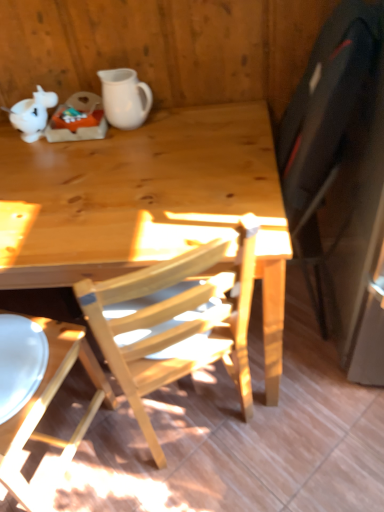
What do you see at coordinates (125, 98) in the screenshot? The image size is (384, 512). I see `white matte pitcher at upper left` at bounding box center [125, 98].

The image size is (384, 512). What are the coordinates of `natural wood desk at center` in the screenshot? It's located at (147, 204).

I want to click on white matte pitcher at upper left, so click(x=125, y=98).

Does point (53, 320) come farther from viewer compared to point (262, 284)?

That is True.

Find the location of a particular element. This screenshot has height=512, width=384. desk above the wooden chair at lower left (from the image's perspective) is located at coordinates point(147,204).

From the image's perspective, which is below, wooden chair at lower left or natural wood desk at center?

wooden chair at lower left, from the image's perspective.

How distant is wooden chair at lower left from natural wood desk at center?

They are 17.82 inches apart.

Is the position of natural wood desk at center less distant than that of white matte teapot at upper left?

Yes.

Between natural wood desk at center and white matte teapot at upper left, which one has less height?

Standing shorter between the two is white matte teapot at upper left.

Looking at the image, does natural wood desk at center seem bigger or smaller compared to white matte teapot at upper left?

In the image, natural wood desk at center appears to be larger than white matte teapot at upper left.

From the image's perspective, who appears lower, white matte pitcher at upper left or white matte teapot at upper left?

white matte teapot at upper left appears lower in the image.

The width and height of the screenshot is (384, 512). In order to click on teapot below the white matte pitcher at upper left (from the image's perspective) in this screenshot , I will do `click(32, 114)`.

In the scene shown: Is white matte pitcher at upper left oriented away from white matte teapot at upper left?

white matte pitcher at upper left does not have its back to white matte teapot at upper left.

From a real-world perspective, does white matte pitcher at upper left sit lower than white matte teapot at upper left?

Actually, white matte pitcher at upper left is physically above white matte teapot at upper left in the real world.

In terms of size, does natural wood desk at center appear bigger or smaller than white matte pitcher at upper left?

Clearly, natural wood desk at center is larger in size than white matte pitcher at upper left.

Is white matte pitcher at upper left a part of natural wood desk at center?

No, white matte pitcher at upper left is not surrounded by natural wood desk at center.

What's the angular difference between natural wood desk at center and white matte pitcher at upper left's facing directions?

They differ by 1.21 degrees in their facing directions.

Find the location of `coffee cup above the natural wood desk at center (from the image's perspective)`. coffee cup above the natural wood desk at center (from the image's perspective) is located at coordinates (125, 98).

From a real-world perspective, is white matte pitcher at upper left over wooden chair at lower left?

Yes, from a real-world perspective, white matte pitcher at upper left is over wooden chair at lower left

From the image's perspective, is white matte pitcher at upper left above or below wooden chair at lower left?

Based on their image positions, white matte pitcher at upper left is located above wooden chair at lower left.

Does point (116, 108) come in front of point (46, 339)?

No, it is behind (46, 339).

Does white matte pitcher at upper left have a greater height compared to wooden chair at lower left?

In fact, white matte pitcher at upper left may be shorter than wooden chair at lower left.

Is white matte teapot at upper left thinner than natural wood desk at center?

Yes.

Is white matte teapot at upper left positioned beyond the bounds of natural wood desk at center?

Yes, white matte teapot at upper left is not within natural wood desk at center.

Is white matte teapot at upper left facing towards natural wood desk at center?

No, white matte teapot at upper left is not turned towards natural wood desk at center.

Can you tell me how much white matte teapot at upper left and natural wood desk at center differ in facing direction?

1.21 degrees.

Which is more to the right, wooden chair at lower left or white matte teapot at upper left?

white matte teapot at upper left.

Considering the relative sizes of wooden chair at lower left and white matte teapot at upper left in the image provided, is wooden chair at lower left bigger than white matte teapot at upper left?

Yes, wooden chair at lower left is bigger than white matte teapot at upper left.

Looking at this image, from the image's perspective, which one is positioned higher, wooden chair at lower left or white matte teapot at upper left?

white matte teapot at upper left, from the image's perspective.

Is wooden chair at lower left taller than white matte teapot at upper left?

Yes.

Locate an element on the screen. desk lying above the wooden chair at lower left (from the image's perspective) is located at coordinates (147, 204).

You are a GUI agent. You are given a task and a screenshot of the screen. Output one action in this format:
    pyautogui.click(x=<x>, y=<y>)
    Task: Click on the desk that is under the white matte teapot at upper left (from a real-world perspective)
    This screenshot has width=384, height=512.
    Given the screenshot: What is the action you would take?
    pyautogui.click(x=147, y=204)

Which object lies nearer to the anchor point natural wood desk at center, white matte pitcher at upper left or white matte teapot at upper left?

white matte pitcher at upper left is closer to natural wood desk at center.

From the image, which object appears to be farther from natural wood desk at center, wooden chair at lower left or white matte teapot at upper left?

white matte teapot at upper left is further to natural wood desk at center.

Looking at the image, which one is located closer to white matte pitcher at upper left, white matte teapot at upper left or natural wood desk at center?

white matte teapot at upper left.

Estimate the real-world distances between objects in this image. Which object is closer to white matte pitcher at upper left, wooden chair at lower left or white matte teapot at upper left?

The object closer to white matte pitcher at upper left is white matte teapot at upper left.

From the image, which object appears to be nearer to white matte teapot at upper left, wooden chair at lower left or white matte pitcher at upper left?

The object closer to white matte teapot at upper left is white matte pitcher at upper left.

From the image, which object appears to be nearer to white matte teapot at upper left, white matte pitcher at upper left or wooden chair at lower left?

white matte pitcher at upper left.

Estimate the real-world distances between objects in this image. Which object is closer to white matte teapot at upper left, wooden chair at lower left or natural wood desk at center?

The object closer to white matte teapot at upper left is natural wood desk at center.

Looking at the image, which one is located further to white matte teapot at upper left, natural wood desk at center or wooden chair at lower left?

wooden chair at lower left is further to white matte teapot at upper left.

Locate an element on the screen. desk between white matte teapot at upper left and wooden chair at lower left in the up-down direction is located at coordinates (147, 204).

Identify the location of teapot between white matte pitcher at upper left and wooden chair at lower left in the vertical direction. (32, 114).

In order to click on desk between white matte pitcher at upper left and wooden chair at lower left vertically in this screenshot , I will do `click(147, 204)`.

The height and width of the screenshot is (512, 384). I want to click on teapot between white matte pitcher at upper left and natural wood desk at center in the vertical direction, so click(32, 114).